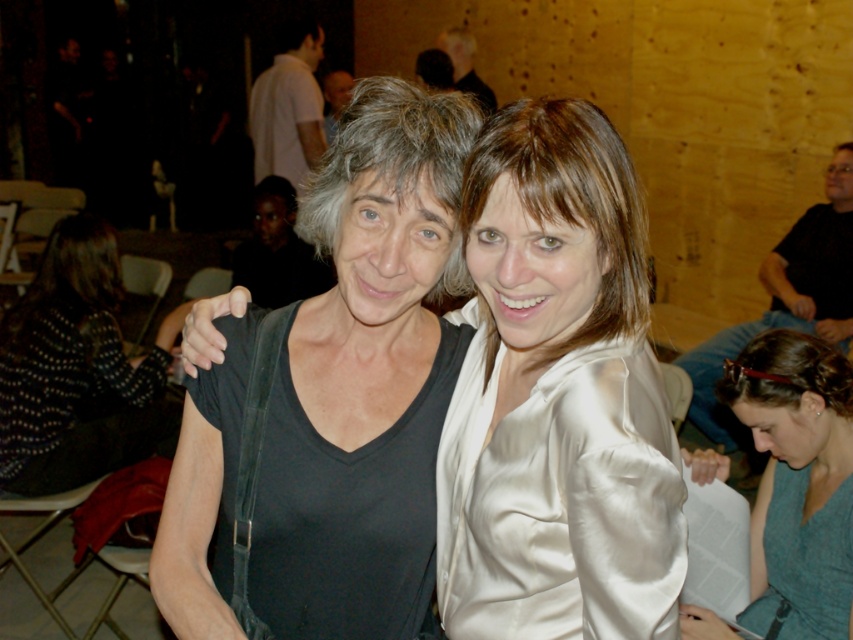
Question: Considering the real-world distances, which object is farthest from the gray silk blouse at lower right?

Choices:
 (A) black matte shirt at left
 (B) black matte shirt at center

Answer: (A)

Question: Does black matte dress at center come in front of black matte shirt at left?

Choices:
 (A) no
 (B) yes

Answer: (B)

Question: Which of the following is the closest to the observer?

Choices:
 (A) satin white blouse at center
 (B) gray silk blouse at lower right
 (C) black matte shirt at center

Answer: (C)

Question: Estimate the real-world distances between objects in this image. Which object is closer to the gray silk blouse at lower right?

Choices:
 (A) blue textured dress at lower right
 (B) black matte dress at center
 (C) satin white blouse at center
 (D) black matte shirt at left

Answer: (A)

Question: Is satin white blouse at center to the right of blue textured dress at lower right from the viewer's perspective?

Choices:
 (A) no
 (B) yes

Answer: (A)

Question: Does black matte shirt at center appear on the right side of blue textured dress at lower right?

Choices:
 (A) yes
 (B) no

Answer: (B)